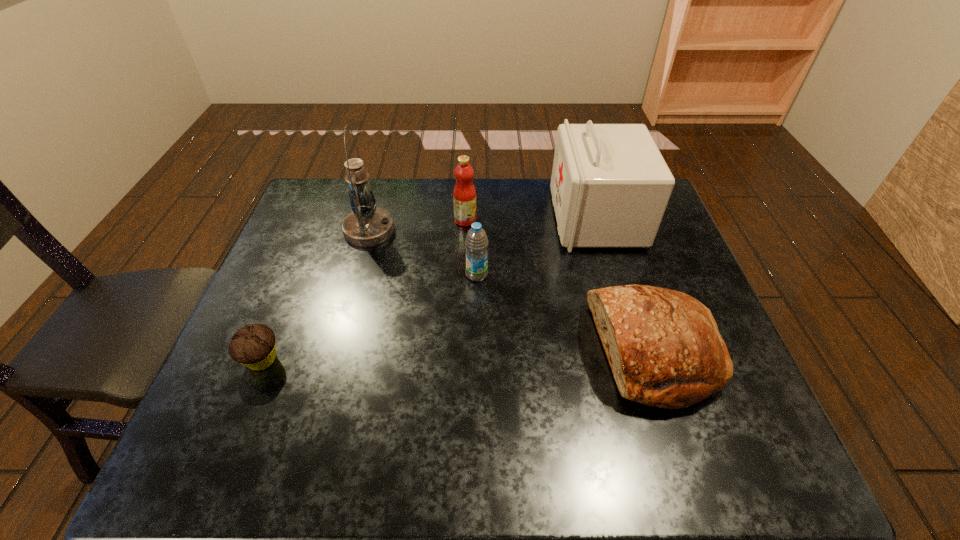
Image resolution: width=960 pixels, height=540 pixels. In order to click on free space between the third nearest object and the first-aid kit in this screenshot , I will do `click(537, 246)`.

Locate an element on the screen. The height and width of the screenshot is (540, 960). free space between the second object from left to right and the bread is located at coordinates (512, 291).

The width and height of the screenshot is (960, 540). Find the location of `free space between the muffin and the fourth farthest object`. free space between the muffin and the fourth farthest object is located at coordinates (370, 318).

You are a GUI agent. You are given a task and a screenshot of the screen. Output one action in this format:
    pyautogui.click(x=<x>, y=<y>)
    Task: Click on the free space between the water bottle and the shortest object
    Image resolution: width=960 pixels, height=540 pixels.
    Given the screenshot: What is the action you would take?
    pyautogui.click(x=370, y=318)

Where is `free spot between the bread and the fifth object from right to left`? Image resolution: width=960 pixels, height=540 pixels. free spot between the bread and the fifth object from right to left is located at coordinates (512, 291).

Find the location of a particular element. This screenshot has width=960, height=540. empty location between the water bottle and the leftmost object is located at coordinates (370, 318).

Find the location of `free space between the first-aid kit and the water bottle`. free space between the first-aid kit and the water bottle is located at coordinates (537, 246).

Locate an element on the screen. vacant space that is in between the oil lamp and the third nearest object is located at coordinates (423, 252).

This screenshot has width=960, height=540. Find the location of `object that is the fourth closest one to the bread`. object that is the fourth closest one to the bread is located at coordinates (367, 225).

Where is `the fifth closest object to the muffin`? The height and width of the screenshot is (540, 960). the fifth closest object to the muffin is located at coordinates (610, 186).